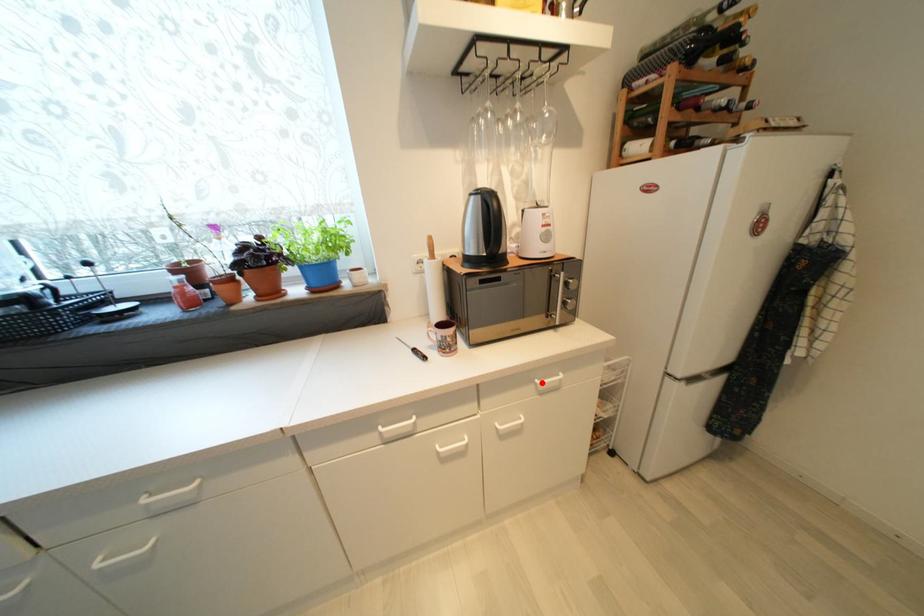
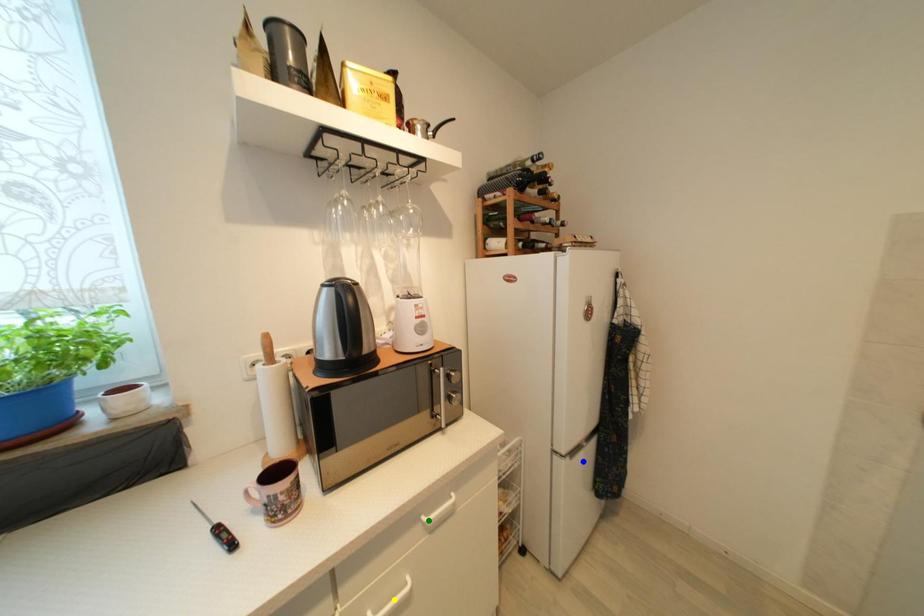
Question: I am providing you with two images of the same scene from different viewpoints. A red point is marked on the first image. You are given multiple points on the second image. Which spot in image 2 lines up with the point in image 1?

Choices:
 (A) green point
 (B) blue point
 (C) yellow point

Answer: (A)